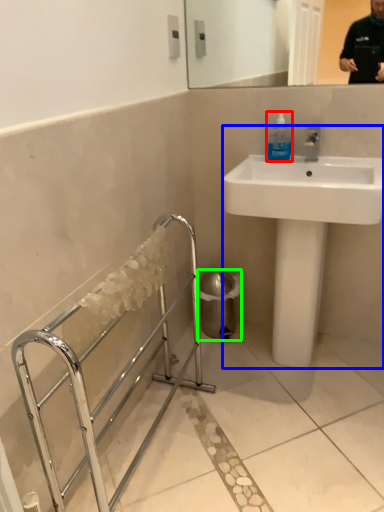
Question: Estimate the real-world distances between objects in this image. Which object is farther from mouthwash (highlighted by a red box), sink (highlighted by a blue box) or trash bin/can (highlighted by a green box)?

Choices:
 (A) sink
 (B) trash bin/can

Answer: (B)